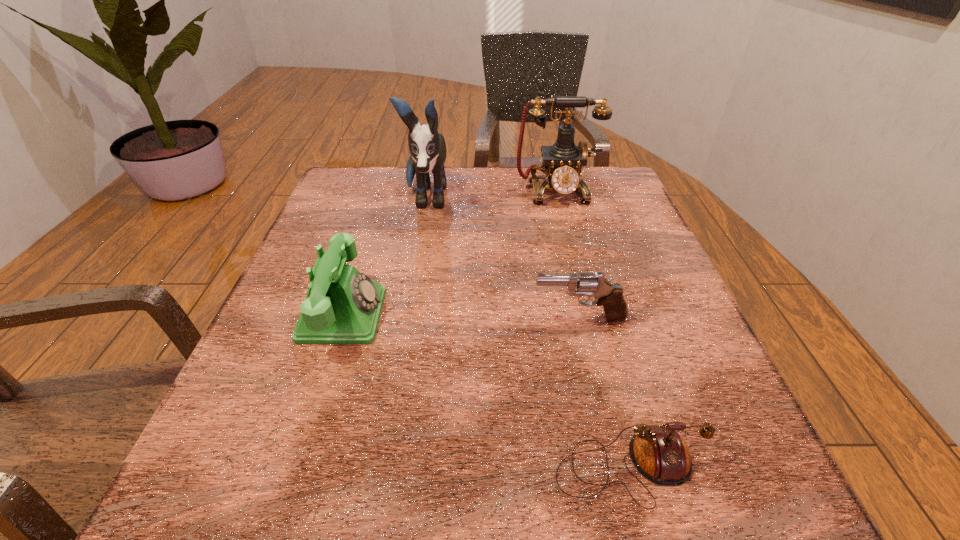
Find the location of a particular element. This screenshot has height=540, width=960. puppy is located at coordinates (427, 147).

This screenshot has width=960, height=540. I want to click on the tallest telephone, so click(x=562, y=162).

Image resolution: width=960 pixels, height=540 pixels. Identify the location of the second tallest object. (562, 162).

Find the location of a particular element. Image resolution: width=960 pixels, height=540 pixels. the third shortest object is located at coordinates (343, 306).

Image resolution: width=960 pixels, height=540 pixels. I want to click on the leftmost telephone, so click(343, 306).

I want to click on the fourth tallest object, so click(x=610, y=296).

Identify the location of the nearest telephone. [x=658, y=452].

At what (x,y) coordinates should I click in order to perform the action: click on the nearest object. Please return your answer as a coordinate pair (x, y). This screenshot has height=540, width=960. Looking at the image, I should click on (x=658, y=452).

I want to click on free space located on the front-facing side of the puppy, so click(410, 290).

Find the location of a particular element. The width and height of the screenshot is (960, 540). vacant area situated 0.200m on the front of the second tallest object, featuring the rotary dial is located at coordinates (573, 259).